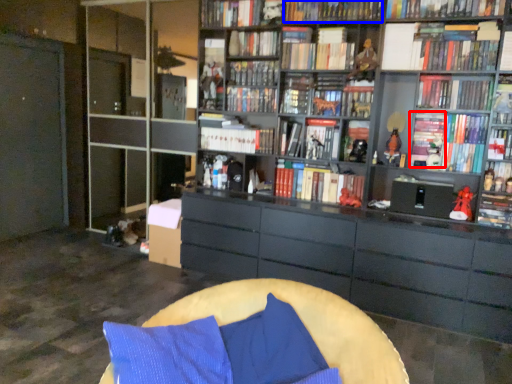
Question: Among these objects, which one is nearest to the camera, book (highlighted by a red box) or book (highlighted by a blue box)?

Choices:
 (A) book
 (B) book

Answer: (B)